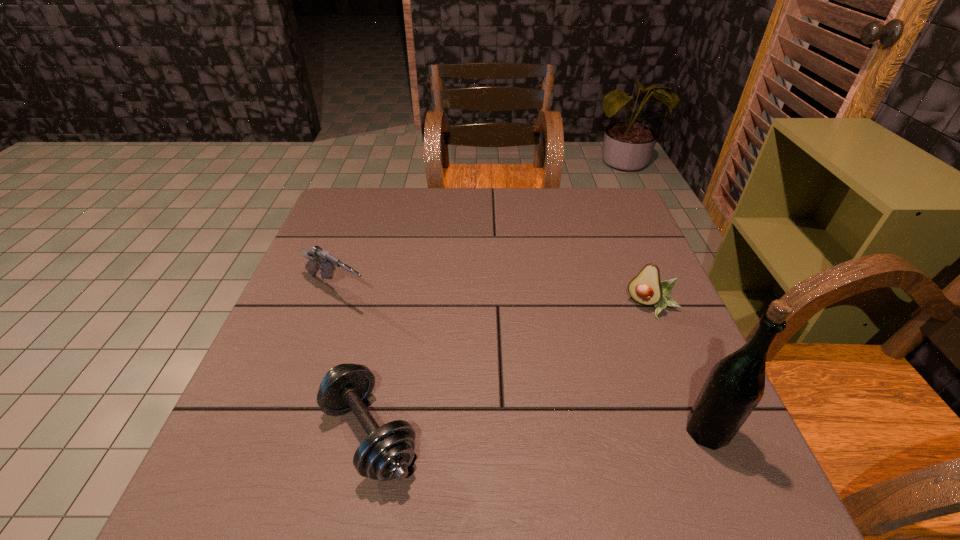
The height and width of the screenshot is (540, 960). Find the location of `free spot on the desktop that is between the dumbbell and the beer bottle and is positioned at the barrel of the gun`. free spot on the desktop that is between the dumbbell and the beer bottle and is positioned at the barrel of the gun is located at coordinates (555, 433).

The height and width of the screenshot is (540, 960). In order to click on free space on the desktop that is between the dumbbell and the beer bottle and is positioned on the seed side of the avocado in this screenshot , I will do `click(581, 433)`.